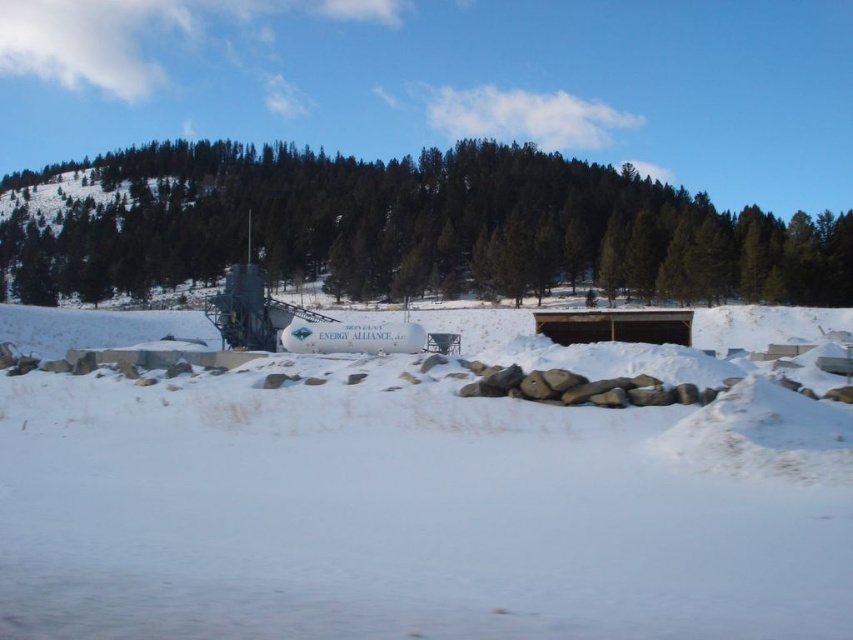
Describe the element at coordinates (413, 512) in the screenshot. I see `white matte snow at center` at that location.

Is white matte snow at center to the left of green matte tree at upper center from the viewer's perspective?

In fact, white matte snow at center is to the right of green matte tree at upper center.

Is point (631, 536) positioned before point (138, 240)?

Yes, it is in front of point (138, 240).

Identify the location of white matte snow at center. (413, 512).